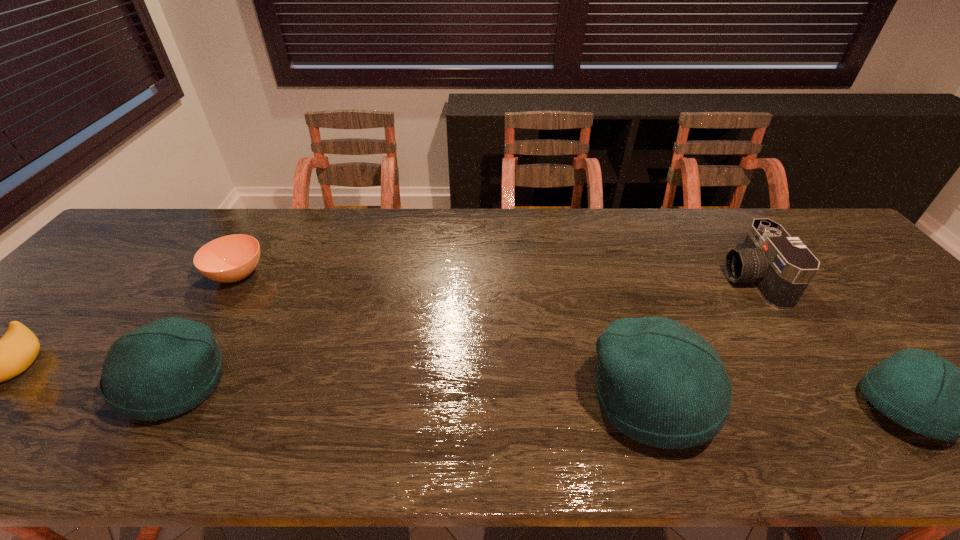
The height and width of the screenshot is (540, 960). What are the coordinates of `the second shortest beanie` in the screenshot? It's located at (163, 369).

Where is `the fifth shortest object`? The image size is (960, 540). the fifth shortest object is located at coordinates (163, 369).

The image size is (960, 540). I want to click on the tallest object, so click(x=660, y=383).

The height and width of the screenshot is (540, 960). I want to click on the third object from right to left, so click(x=660, y=383).

Where is `soup bowl`? The width and height of the screenshot is (960, 540). soup bowl is located at coordinates (227, 259).

The image size is (960, 540). In order to click on camera in this screenshot , I will do `click(780, 267)`.

The width and height of the screenshot is (960, 540). What are the coordinates of `vacant space situated 0.180m on the back of the second tallest object` in the screenshot? It's located at (232, 293).

This screenshot has height=540, width=960. Find the location of `blank area located 0.190m on the back of the fourth object from left to right`. blank area located 0.190m on the back of the fourth object from left to right is located at coordinates (617, 296).

Locate an element on the screen. The width and height of the screenshot is (960, 540). vacant region located on the right of the soup bowl is located at coordinates (363, 274).

Image resolution: width=960 pixels, height=540 pixels. Identify the location of free point located on the front-facing side of the camera. (693, 280).